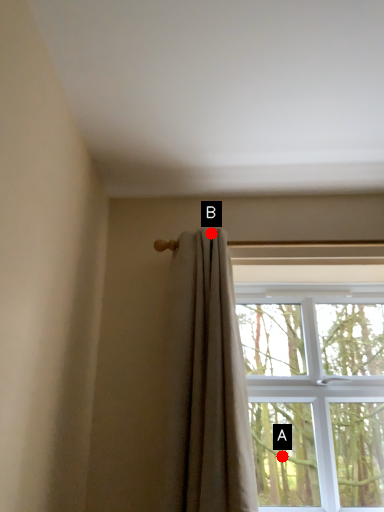
Question: Two points are circled on the image, labeled by A and B beside each circle. Which of the following is the farthest from the observer?

Choices:
 (A) A is further
 (B) B is further

Answer: (A)